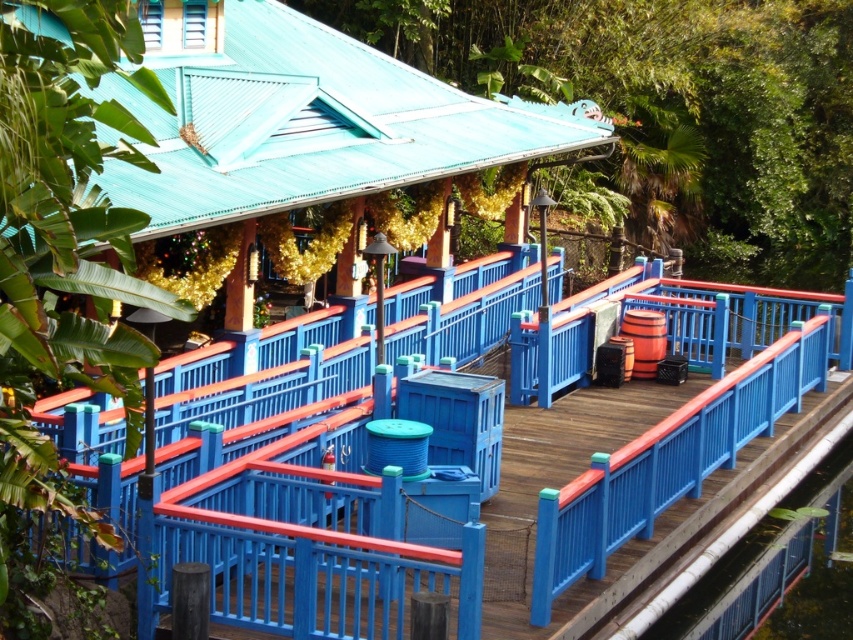
Looking at this image, you are standing at the point labeled as point (267, 499) in the image. What is the object you are standing on?

The point (267, 499) indicates the blue painted wood deck at center.

You are a delivery person with a cart that is 2 meters wide. You need to move your cart from the blue painted wood deck at center to the blue painted wood at right. Is there enough space between them for your cart to pass through?

The blue painted wood deck at center is 1.77 meters from the blue painted wood at right. Since the cart is 2 meters wide, it is wider than the available space, so the cart cannot pass through the 1.77 meter gap between them.